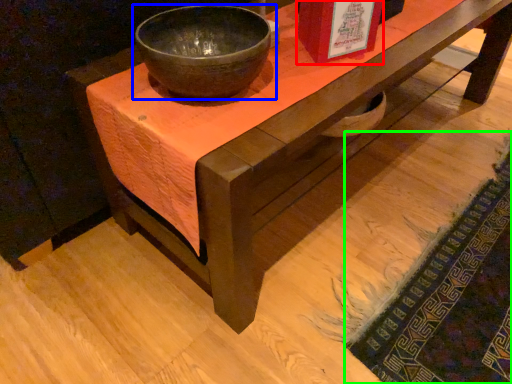
Question: Which object is positioned closest to book cover (highlighted by a red box)? Select from bowl (highlighted by a blue box) and mat (highlighted by a green box).

Choices:
 (A) bowl
 (B) mat

Answer: (A)